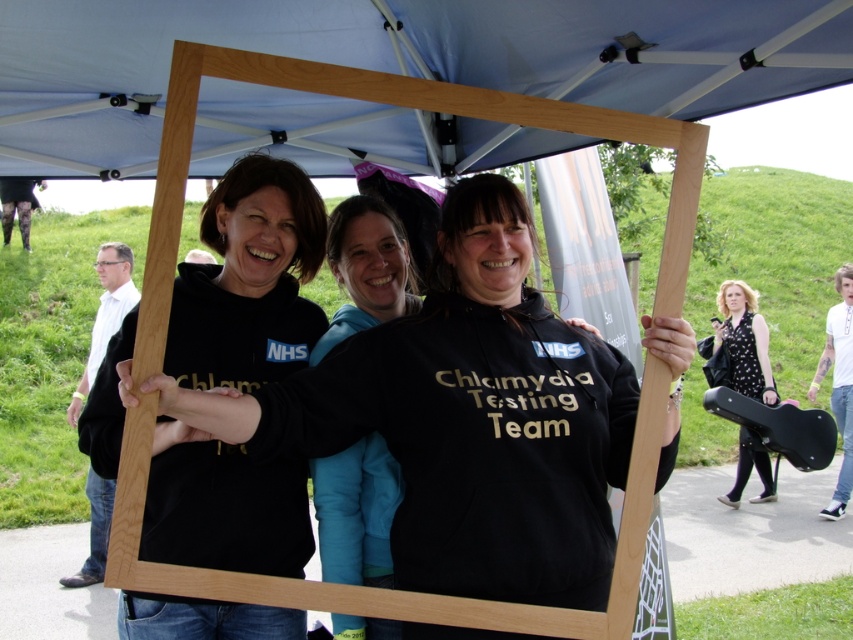
Question: Does matte black hoodie at center appear over black matte sweatshirt at center?

Choices:
 (A) no
 (B) yes

Answer: (A)

Question: Estimate the real-world distances between objects in this image. Which object is closer to the black dotted dress at lower right?

Choices:
 (A) black matte sweatshirt at center
 (B) blue fabric canopy at upper center

Answer: (A)

Question: Estimate the real-world distances between objects in this image. Which object is farther from the black matte sweatshirt at center?

Choices:
 (A) blue fabric canopy at upper center
 (B) black fleece at center
 (C) white glossy shirt at left

Answer: (C)

Question: Which object is positioned farthest from the blue fabric canopy at upper center?

Choices:
 (A) black fleece at center
 (B) white glossy shirt at left
 (C) matte black hoodie at center

Answer: (B)

Question: Can you confirm if matte black hoodie at center is smaller than black dotted dress at lower right?

Choices:
 (A) no
 (B) yes

Answer: (A)

Question: Is blue fabric canopy at upper center further to the viewer compared to matte black hoodie at center?

Choices:
 (A) yes
 (B) no

Answer: (B)